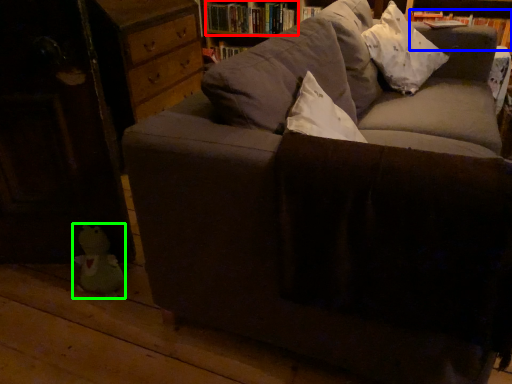
Question: Which object is positioned farthest from book (highlighted by a red box)? Select from book (highlighted by a blue box) and toy (highlighted by a green box).

Choices:
 (A) book
 (B) toy

Answer: (B)